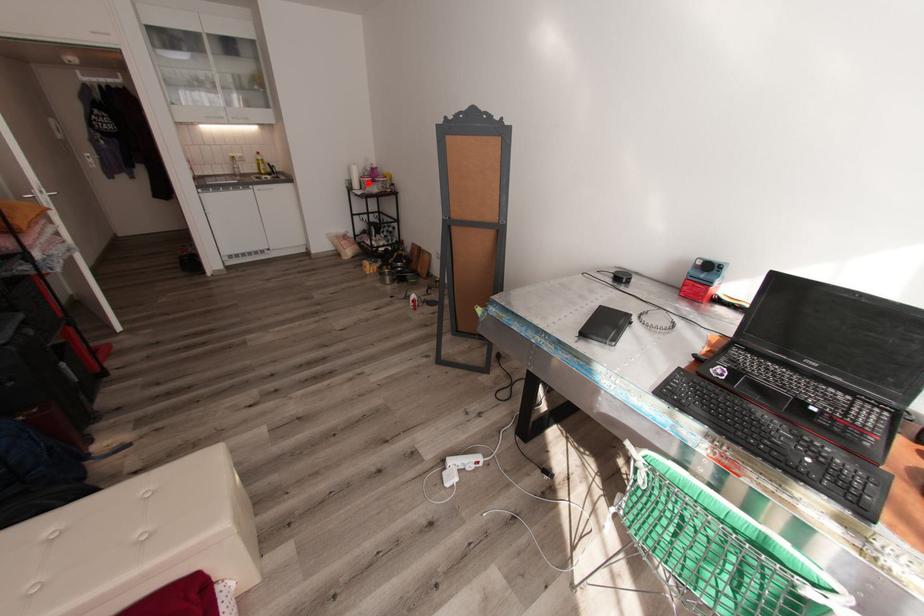
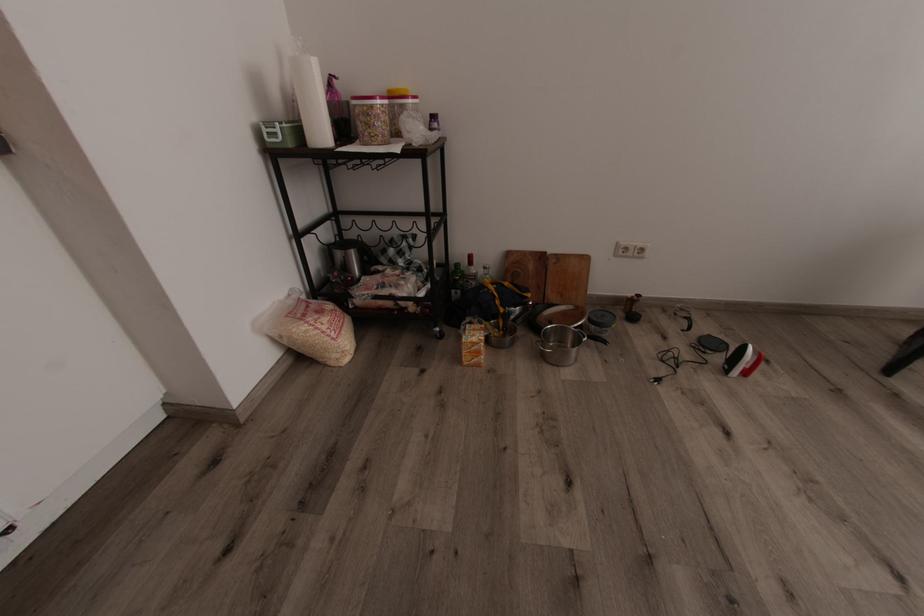
Locate, in the second image, the point that corresponds to the highlighted location in the first image.

(382, 116)